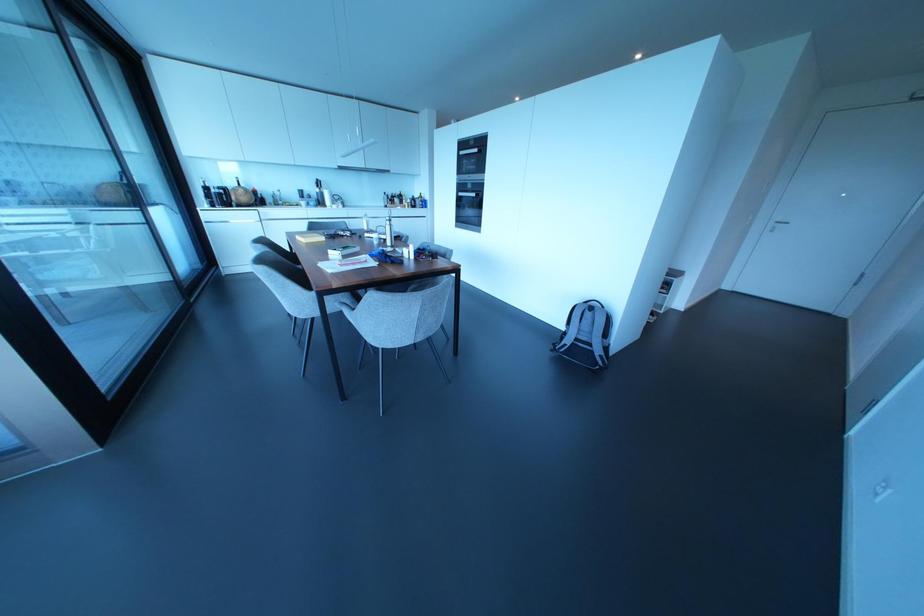
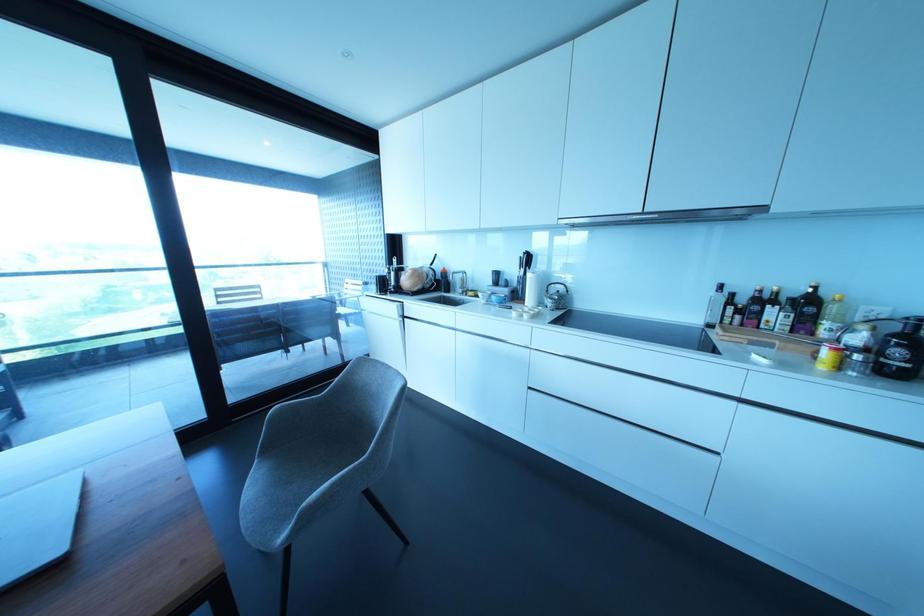
Find the pixel in the second image that matches point (310, 203) in the first image.

(492, 297)